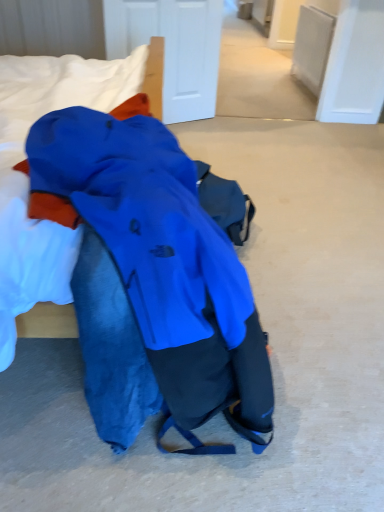
Question: From a real-world perspective, is blue fabric at upper left positioned above or below matte blue jacket at center?

Choices:
 (A) below
 (B) above

Answer: (B)

Question: From the image's perspective, is blue fabric at upper left positioned above or below matte blue jacket at center?

Choices:
 (A) above
 (B) below

Answer: (A)

Question: Looking at the image, does blue fabric at upper left seem bigger or smaller compared to matte blue jacket at center?

Choices:
 (A) small
 (B) big

Answer: (A)

Question: Is matte blue jacket at center in front of or behind blue fabric at upper left in the image?

Choices:
 (A) front
 (B) behind

Answer: (A)

Question: In terms of size, does matte blue jacket at center appear bigger or smaller than blue fabric at upper left?

Choices:
 (A) big
 (B) small

Answer: (A)

Question: Would you say matte blue jacket at center is inside or outside blue fabric at upper left?

Choices:
 (A) outside
 (B) inside

Answer: (A)

Question: From a real-world perspective, relative to blue fabric at upper left, is matte blue jacket at center vertically above or below?

Choices:
 (A) above
 (B) below

Answer: (B)